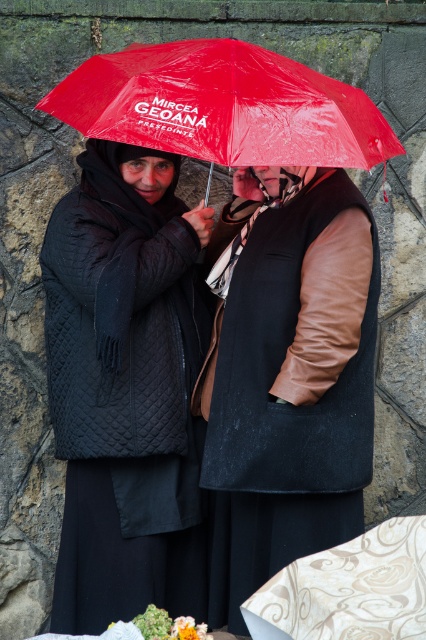
You are standing in front of the two people under the red umbrella. You want to place a small gift exactly at the position of point [112,596] and another gift at point [226,97]. Which gift will be closer to you?

The gift at point [112,596] will be closer to you because it is further to the viewer than point [226,97].

From the picture: You are a photographer trying to capture a clear shot of the matte black coat at center and the red plastic umbrella at upper center. Which object should you focus on first if you want to ensure both are in focus without adjusting the camera settings?

The matte black coat at center is thinner than the red plastic umbrella at upper center, so focusing on the matte black coat at center first would ensure both are within the depth of field since it is closer to the camera.